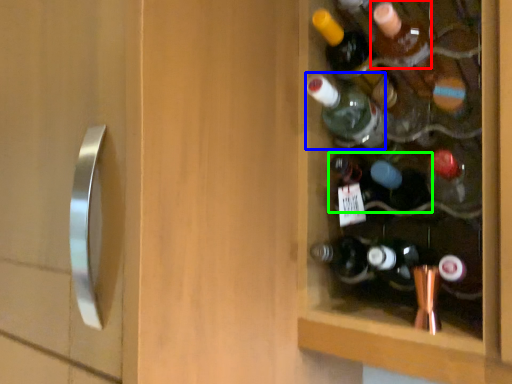
Question: Based on their relative distances, which object is nearer to bottle (highlighted by a red box)? Choose from bottle (highlighted by a blue box) and bottle (highlighted by a green box).

Choices:
 (A) bottle
 (B) bottle

Answer: (A)